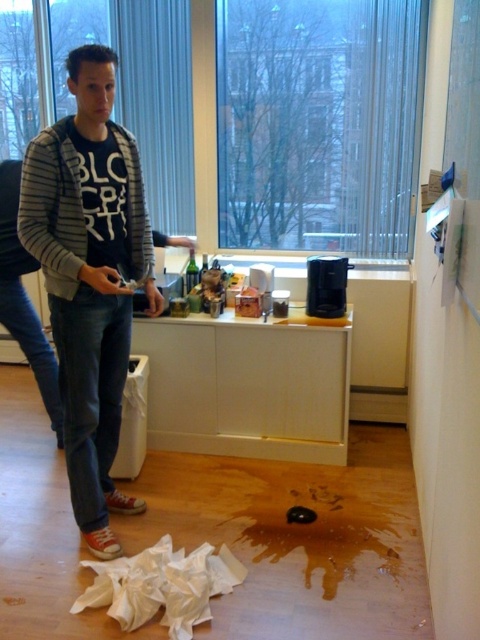
Who is positioned more to the left, striped cotton shirt at upper left or white matte toilet paper at center?

striped cotton shirt at upper left is more to the left.

You are a GUI agent. You are given a task and a screenshot of the screen. Output one action in this format:
    pyautogui.click(x=<x>, y=<y>)
    Task: Click on the striped cotton shirt at upper left
    
    Given the screenshot: What is the action you would take?
    pyautogui.click(x=90, y=276)

Does white crumpled toilet paper at lower left appear on the right side of white matte toilet paper at center?

In fact, white crumpled toilet paper at lower left is to the left of white matte toilet paper at center.

Can you confirm if white crumpled toilet paper at lower left is smaller than white matte toilet paper at center?

Incorrect, white crumpled toilet paper at lower left is not smaller in size than white matte toilet paper at center.

The image size is (480, 640). Find the location of `white crumpled toilet paper at lower left`. white crumpled toilet paper at lower left is located at coordinates (162, 586).

Who is taller, striped cotton shirt at upper left or white crumpled toilet paper at lower left?

striped cotton shirt at upper left

Which of these two, striped cotton shirt at upper left or white crumpled toilet paper at lower left, stands shorter?

With less height is white crumpled toilet paper at lower left.

What do you see at coordinates (90, 276) in the screenshot?
I see `striped cotton shirt at upper left` at bounding box center [90, 276].

The height and width of the screenshot is (640, 480). What are the coordinates of `striped cotton shirt at upper left` in the screenshot? It's located at (90, 276).